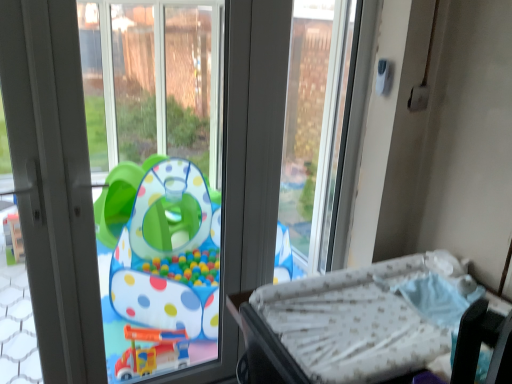
Question: Is transparent plastic window screen at upper center, which is the second window screen from left to right, located outside white dotted mattress at lower right?

Choices:
 (A) no
 (B) yes

Answer: (B)

Question: Can you confirm if transparent plastic window screen at upper center, which is the second window screen from left to right, is positioned to the left of white dotted mattress at lower right?

Choices:
 (A) no
 (B) yes

Answer: (B)

Question: Is transparent plastic window screen at upper center, which is the second window screen from left to right, closer to the viewer compared to white dotted mattress at lower right?

Choices:
 (A) no
 (B) yes

Answer: (A)

Question: Considering the relative sizes of transparent plastic window screen at upper center, which is the second window screen from left to right, and white dotted mattress at lower right in the image provided, is transparent plastic window screen at upper center, which is the second window screen from left to right, taller than white dotted mattress at lower right?

Choices:
 (A) no
 (B) yes

Answer: (B)

Question: Is transparent plastic window screen at upper center, which is the second window screen from left to right, oriented towards white dotted mattress at lower right?

Choices:
 (A) yes
 (B) no

Answer: (A)

Question: Considering the positions of transparent plastic window screen at upper center, marked as the 1th window screen in a right-to-left arrangement, and transparent plastic playpen at center, placed as the 1th window screen when sorted from left to right, in the image, is transparent plastic window screen at upper center, marked as the 1th window screen in a right-to-left arrangement, wider or thinner than transparent plastic playpen at center, placed as the 1th window screen when sorted from left to right,?

Choices:
 (A) thin
 (B) wide

Answer: (A)

Question: In terms of height, does transparent plastic window screen at upper center, marked as the 1th window screen in a right-to-left arrangement, look taller or shorter compared to transparent plastic playpen at center, arranged as the second window screen when viewed from the right?

Choices:
 (A) short
 (B) tall

Answer: (A)

Question: Choose the correct answer: Is transparent plastic window screen at upper center, which is the second window screen from left to right, inside transparent plastic playpen at center, placed as the 1th window screen when sorted from left to right, or outside it?

Choices:
 (A) outside
 (B) inside

Answer: (A)

Question: Is transparent plastic window screen at upper center, which is the second window screen from left to right, in front of or behind transparent plastic playpen at center, arranged as the second window screen when viewed from the right, in the image?

Choices:
 (A) front
 (B) behind

Answer: (B)

Question: Considering the positions of point (95, 54) and point (41, 226), is point (95, 54) closer or farther from the camera than point (41, 226)?

Choices:
 (A) closer
 (B) farther

Answer: (B)

Question: Based on their positions, is transparent plastic playpen at center, arranged as the second window screen when viewed from the right, located to the left or right of white plastic screen door at left?

Choices:
 (A) left
 (B) right

Answer: (B)

Question: Looking at their shapes, would you say transparent plastic playpen at center, arranged as the second window screen when viewed from the right, is wider or thinner than white plastic screen door at left?

Choices:
 (A) thin
 (B) wide

Answer: (B)

Question: From the image's perspective, is transparent plastic playpen at center, placed as the 1th window screen when sorted from left to right, above or below white plastic screen door at left?

Choices:
 (A) above
 (B) below

Answer: (B)

Question: Considering the positions of white plastic screen door at left and transparent plastic playpen at center, placed as the 1th window screen when sorted from left to right, in the image, is white plastic screen door at left wider or thinner than transparent plastic playpen at center, placed as the 1th window screen when sorted from left to right,?

Choices:
 (A) wide
 (B) thin

Answer: (B)

Question: Visually, is white plastic screen door at left positioned to the left or to the right of transparent plastic playpen at center, arranged as the second window screen when viewed from the right?

Choices:
 (A) left
 (B) right

Answer: (A)